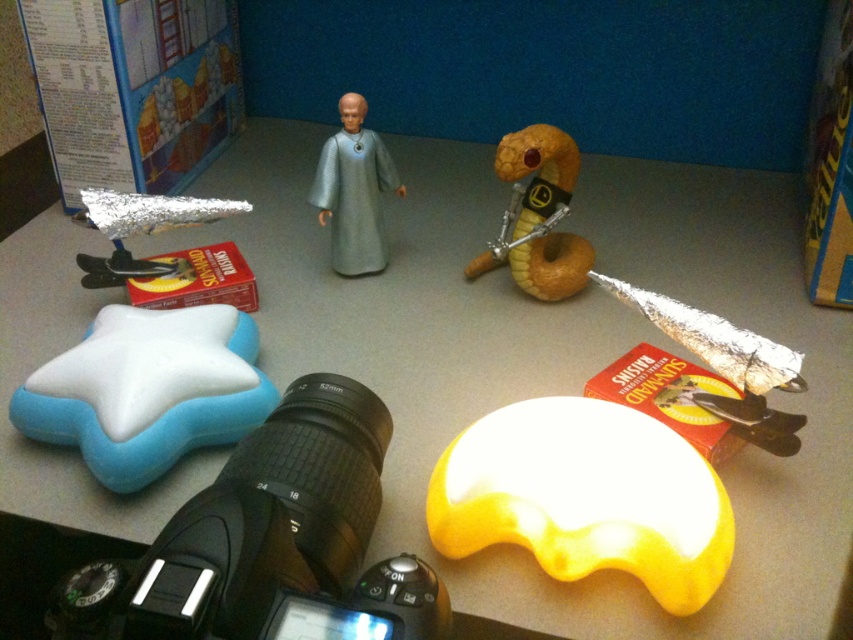
Does point (178, 384) come farther from viewer compared to point (550, 145)?

No, it is in front of (550, 145).

Between point (123, 385) and point (511, 195), which one is positioned behind?

Point (511, 195)

Where is `blue soft star at lower left`? The height and width of the screenshot is (640, 853). blue soft star at lower left is located at coordinates (148, 390).

Does shiny gold snake at center have a greater height compared to satin silver figure at center?

Indeed, shiny gold snake at center has a greater height compared to satin silver figure at center.

Is shiny gold snake at center to the right of satin silver figure at center from the viewer's perspective?

Indeed, shiny gold snake at center is positioned on the right side of satin silver figure at center.

Describe the element at coordinates (537, 216) in the screenshot. I see `shiny gold snake at center` at that location.

Where is `shiny gold snake at center`? The height and width of the screenshot is (640, 853). shiny gold snake at center is located at coordinates (537, 216).

Can you confirm if black plastic camera at lower left is thinner than blue soft star at lower left?

No.

Can you confirm if black plastic camera at lower left is taller than blue soft star at lower left?

In fact, black plastic camera at lower left may be shorter than blue soft star at lower left.

Who is more forward, (381,426) or (131,412)?

Point (131,412) is in front.

At what (x,y) coordinates should I click in order to perform the action: click on black plastic camera at lower left. Please return your answer as a coordinate pair (x, y). Looking at the image, I should click on (271, 541).